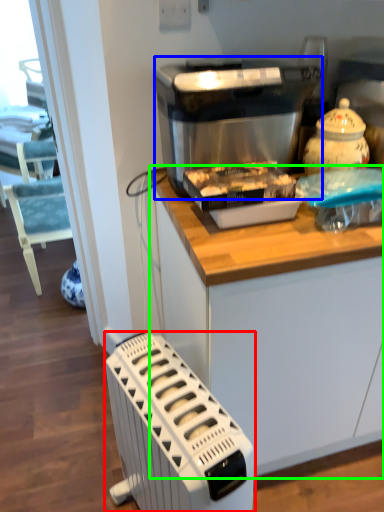
Question: Considering the real-world distances, which object is farthest from home appliance (highlighted by a red box)? kitchen appliance (highlighted by a blue box) or cabinetry (highlighted by a green box)?

Choices:
 (A) kitchen appliance
 (B) cabinetry

Answer: (A)